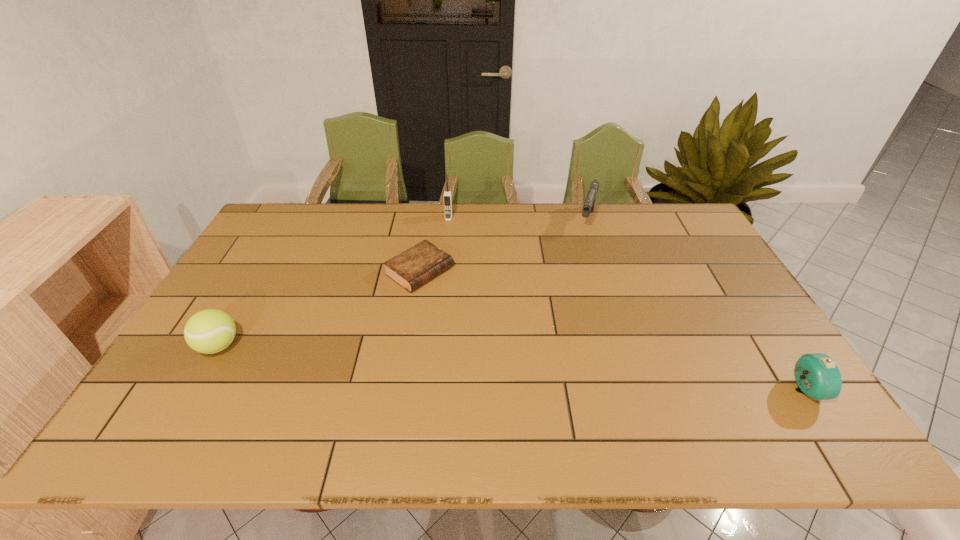
This screenshot has height=540, width=960. Find the location of `the leftmost object`. the leftmost object is located at coordinates (209, 331).

Locate an element on the screen. The image size is (960, 540). tennis ball is located at coordinates (209, 331).

Find the location of a particular element. The image size is (960, 540). the rightmost object is located at coordinates (817, 375).

At what (x,y) coordinates should I click in order to perform the action: click on alarm clock. Please return your answer as a coordinate pair (x, y). This screenshot has width=960, height=540. Looking at the image, I should click on (817, 375).

Where is `the fourth object from left to right`? the fourth object from left to right is located at coordinates (588, 206).

This screenshot has height=540, width=960. In order to click on the shortest object in this screenshot , I will do `click(414, 267)`.

The height and width of the screenshot is (540, 960). Identify the location of the third farthest object. (414, 267).

Image resolution: width=960 pixels, height=540 pixels. What are the coordinates of `cellular telephone` in the screenshot? It's located at (447, 196).

Image resolution: width=960 pixels, height=540 pixels. In order to click on free location located on the right of the leftmost object in this screenshot , I will do `click(325, 346)`.

The image size is (960, 540). I want to click on free space located 0.280m in the direction the second object from right to left is aimed, so click(x=570, y=285).